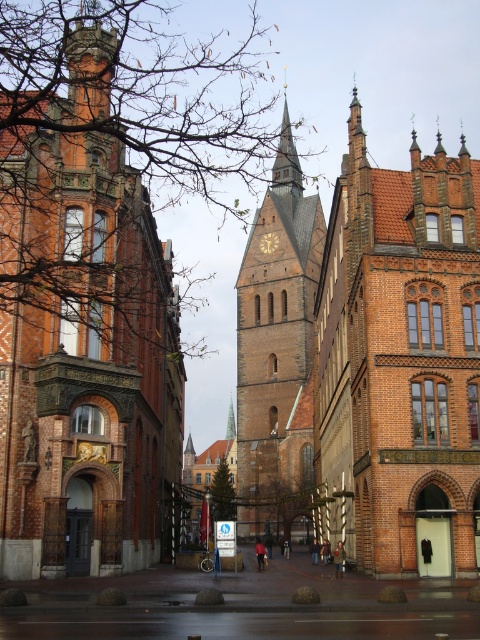
You are an architect designing a new building that needs to fit between the brown brick church at center and the gold textured clock at center. Based on their widths, can you determine which side of the gap between them has more space for your design?

The brown brick church at center might be wider than gold textured clock at center, so the side closer to the gold textured clock at center likely has more space available for your design.

You are standing in the middle of the square in front of the historic church tower. You notice two points marked in the scene. One is at coordinates point (x=358, y=563) and the other is at point (x=272, y=243). Which point is closer to you?

Point (x=358, y=563) is closer to the viewer than point (x=272, y=243).